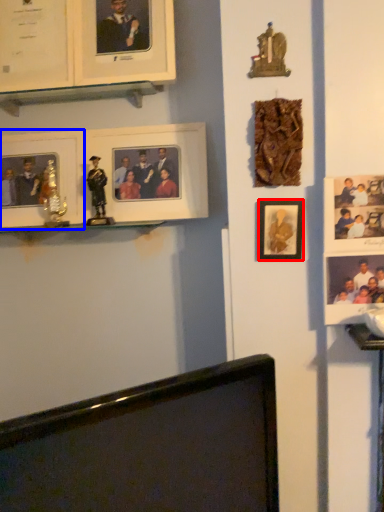
Question: Which point is further to the camera, picture frame (highlighted by a red box) or picture frame (highlighted by a blue box)?

Choices:
 (A) picture frame
 (B) picture frame

Answer: (B)